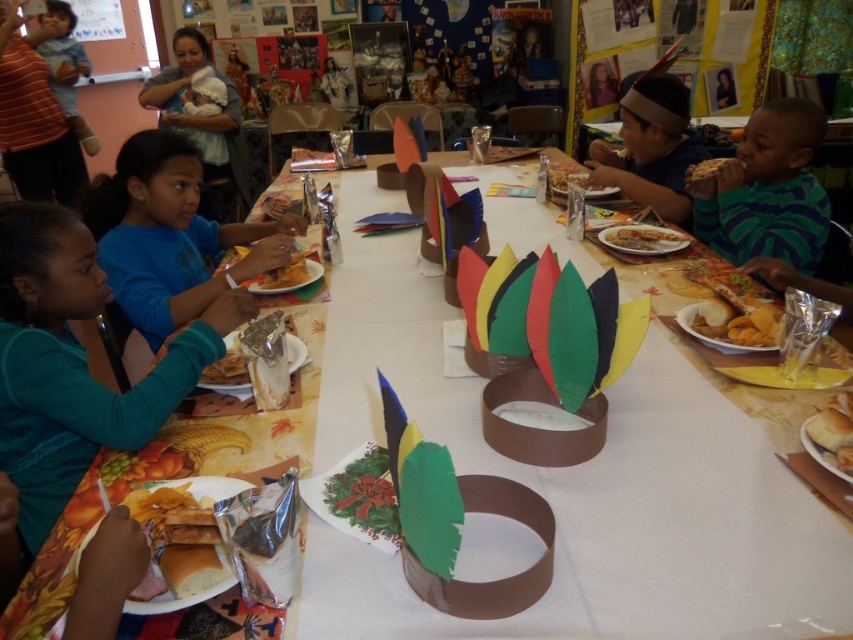
Question: Is the position of matte blue shirt at upper left more distant than that of yellow crinkled foil at upper right?

Choices:
 (A) yes
 (B) no

Answer: (A)

Question: Which object appears farthest from the camera in this image?

Choices:
 (A) yellow crinkled foil at upper right
 (B) yellow paper plate at center
 (C) matte blue shirt at upper left

Answer: (C)

Question: Does white paper plate at lower left appear over matte brown paper plate at upper center?

Choices:
 (A) yes
 (B) no

Answer: (B)

Question: Where is green striped shirt at right located in relation to yellow crinkled foil at upper right in the image?

Choices:
 (A) right
 (B) left

Answer: (A)

Question: Which of the following is the farthest from the observer?

Choices:
 (A) (22, 362)
 (B) (680, 248)
 (C) (291, 280)
 (D) (44, 22)

Answer: (D)

Question: Which is nearer to the matte blue shirt at upper left?

Choices:
 (A) brown paper plate at center
 (B) yellow paper plate at center
 (C) matte brown paper hat at upper right

Answer: (C)